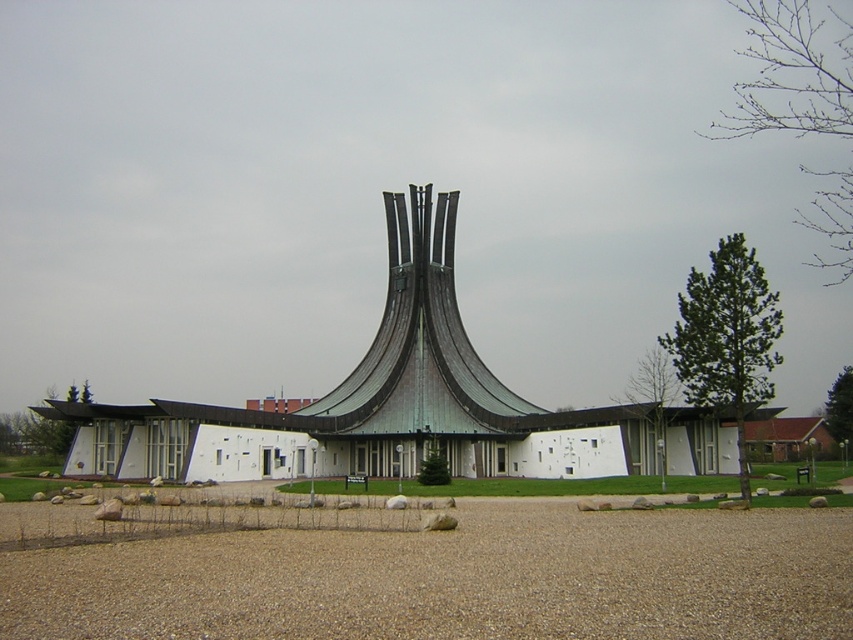
You are a landscape architect designing a pathway leading to the white matte building at center. The pathway will be made of brown gravel at lower center. Considering their heights, will the pathway be level with the building entrance or slope downward towards it?

The brown gravel at lower center has a lesser height compared to the white matte building at center, so the pathway made of brown gravel at lower center will slope downward towards the building entrance.

You are a landscape architect designing a pathway. You have a section of brown gravel at lower center and a white matte building at center in your design. If you want to ensure the pathway is wider than the building, based on the current layout, would that be possible?

The brown gravel at lower center has a width less than the white matte building at center, so the pathway cannot be wider than the building as the gravel itself is narrower than the building.

You are a landscape architect designing a pathway leading to the white matte building at center. You have a bag of brown gravel at lower center. Where should you place the gravel relative to the building to follow the existing layout?

The brown gravel at lower center should be placed on the right side of the white matte building at center as it is already positioned there in the existing layout.